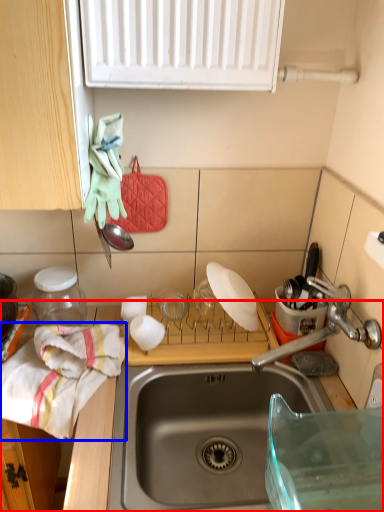
Question: Which object appears farthest to the camera in this image, countertop (highlighted by a red box) or material (highlighted by a blue box)?

Choices:
 (A) countertop
 (B) material

Answer: (B)